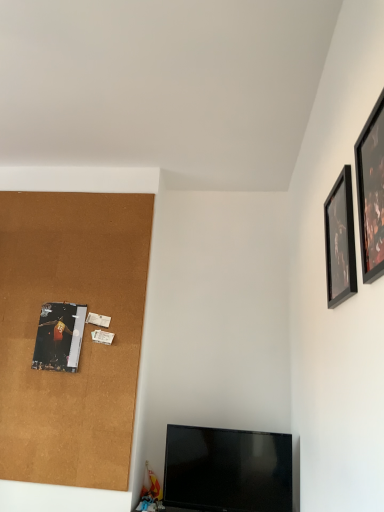
Question: From a real-world perspective, is metallic silver poster at left, the 1th picture frame when ordered from left to right, below black matte picture frame at upper right, placed as the 2th picture frame when sorted from back to front?

Choices:
 (A) no
 (B) yes

Answer: (B)

Question: Is metallic silver poster at left, which appears as the 3th picture frame when viewed from the right, facing away from black matte picture frame at upper right, placed as the 2th picture frame when sorted from back to front?

Choices:
 (A) yes
 (B) no

Answer: (B)

Question: From the image's perspective, is metallic silver poster at left, which is counted as the 1th picture frame, starting from the back, located beneath black matte picture frame at upper right, the 2th picture frame viewed from the front?

Choices:
 (A) yes
 (B) no

Answer: (A)

Question: Considering the relative sizes of metallic silver poster at left, which appears as the 3th picture frame when viewed from the right, and black matte picture frame at upper right, positioned as the 1th picture frame in right-to-left order, in the image provided, is metallic silver poster at left, which appears as the 3th picture frame when viewed from the right, shorter than black matte picture frame at upper right, positioned as the 1th picture frame in right-to-left order,?

Choices:
 (A) no
 (B) yes

Answer: (B)

Question: Does metallic silver poster at left, which appears as the 3th picture frame when viewed from the right, appear on the right side of black matte picture frame at upper right, placed as the third picture frame when sorted from left to right?

Choices:
 (A) no
 (B) yes

Answer: (A)

Question: Is cork board at left wider or thinner than black glossy tv at lower center?

Choices:
 (A) wide
 (B) thin

Answer: (B)

Question: Based on their sizes in the image, would you say cork board at left is bigger or smaller than black glossy tv at lower center?

Choices:
 (A) big
 (B) small

Answer: (A)

Question: From a real-world perspective, relative to black glossy tv at lower center, is cork board at left vertically above or below?

Choices:
 (A) below
 (B) above

Answer: (B)

Question: Do you think cork board at left is within black glossy tv at lower center, or outside of it?

Choices:
 (A) inside
 (B) outside

Answer: (B)

Question: Is black glossy tv at lower center wider or thinner than metallic silver poster at left, the 1th picture frame when ordered from left to right?

Choices:
 (A) thin
 (B) wide

Answer: (B)

Question: From the image's perspective, relative to metallic silver poster at left, which appears as the 3th picture frame when viewed from the right, is black glossy tv at lower center above or below?

Choices:
 (A) above
 (B) below

Answer: (B)

Question: Which is correct: black glossy tv at lower center is inside metallic silver poster at left, the third picture frame positioned from the front, or outside of it?

Choices:
 (A) inside
 (B) outside

Answer: (B)

Question: Considering their positions, is black glossy tv at lower center located in front of or behind metallic silver poster at left, which is counted as the 1th picture frame, starting from the back?

Choices:
 (A) behind
 (B) front

Answer: (B)

Question: From the image's perspective, is cork board at left positioned above or below black matte picture frame at upper right, the 2th picture frame viewed from the front?

Choices:
 (A) above
 (B) below

Answer: (B)

Question: Is point (13, 335) closer or farther from the camera than point (350, 262)?

Choices:
 (A) farther
 (B) closer

Answer: (A)